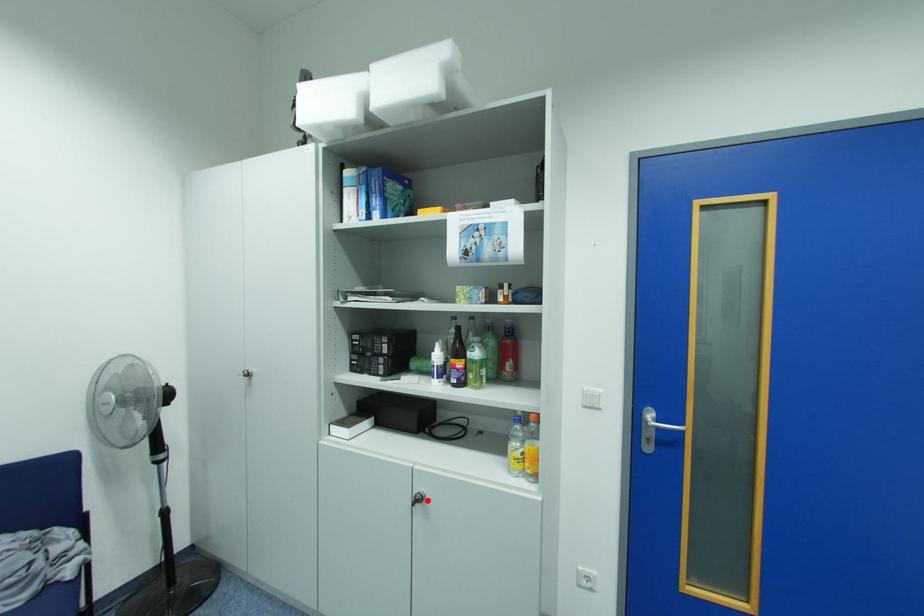
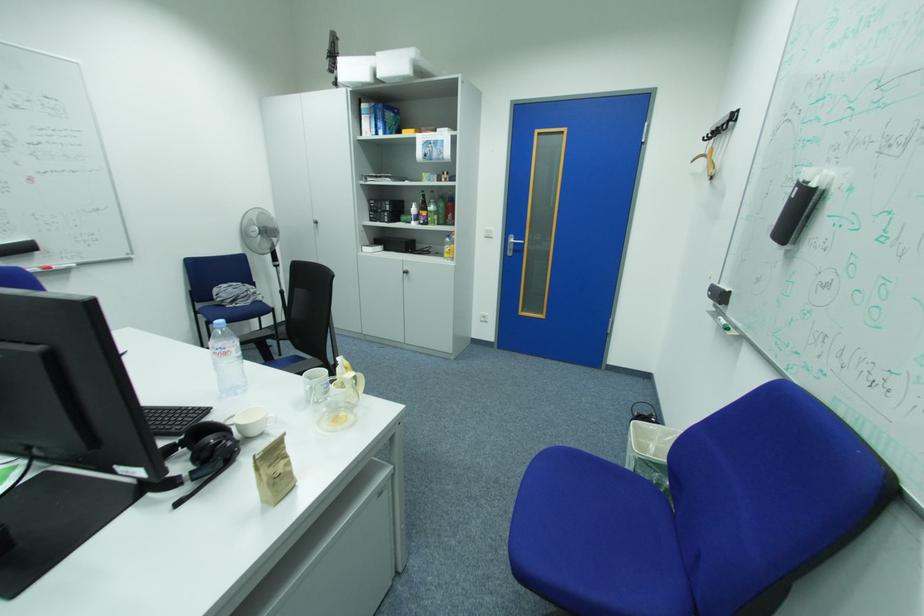
Question: I am providing you with two images of the same scene from different viewpoints. Image1 has a red point marked. In image2, the corresponding 3D location appears at what relative position? Reply with the corresponding letter.

Choices:
 (A) Closer
 (B) Farther

Answer: (A)